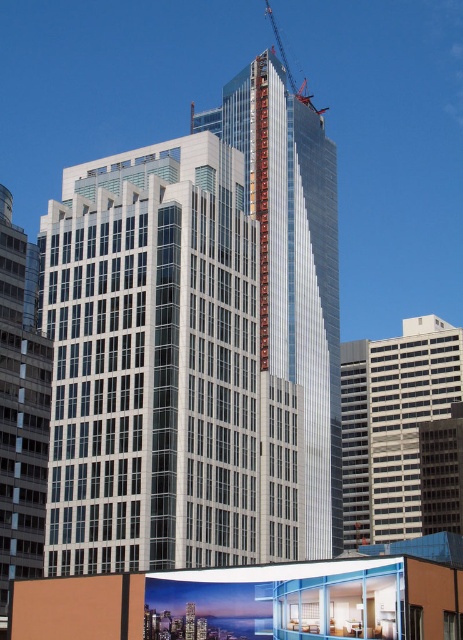
You are a city planner reviewing the urban layout. From your vantage point, which building would appear closer to you, the sleek glass tower at center or the silver glass building at left?

The sleek glass tower at center appears closer because the silver glass building at left is positioned behind it.

You are standing at a safe distance from the glassy silver skyscraper at center. If you want to take a photo of it without any obstructions, would you need to move closer or farther away?

The glassy silver skyscraper at center is 97.94 meters away from the viewer. To take a photo without obstructions, you might need to move farther away to ensure the entire structure fits in the frame, as being too close could cause parts of the building to be cut off.

You are a city planner reviewing the construction site. You need to determine which building is closer to the camera. Based on the scene, which one is closer? The glassy silver skyscraper at center or the silver glass building at left?

The glassy silver skyscraper at center is closer to the camera because the silver glass building at left is positioned behind it.